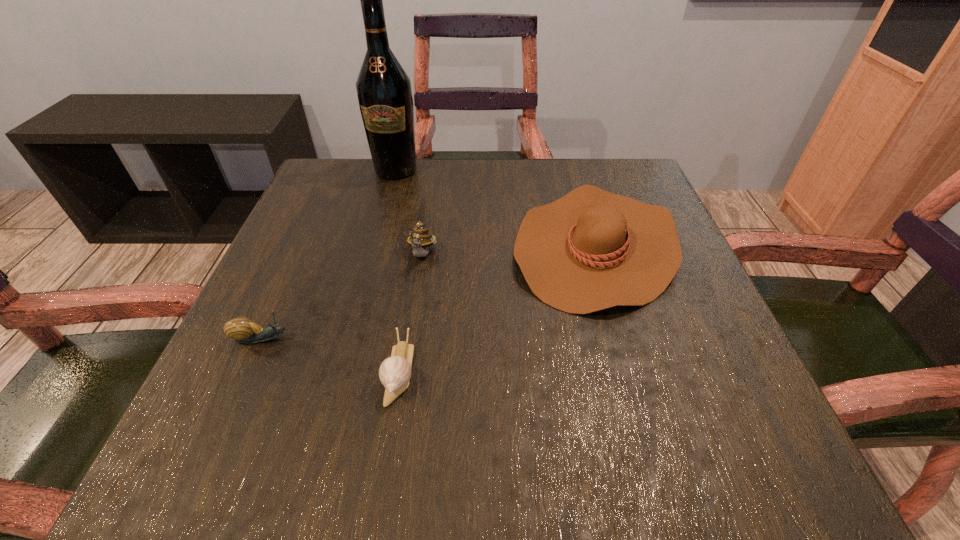
Where is `vacant space that's between the wine bottle and the leftmost object`? The height and width of the screenshot is (540, 960). vacant space that's between the wine bottle and the leftmost object is located at coordinates (329, 254).

Locate an element on the screen. The width and height of the screenshot is (960, 540). vacant region between the leftmost escargot and the tallest escargot is located at coordinates (343, 297).

Where is `vacant area that lies between the tallest escargot and the fourth object from right to left`? vacant area that lies between the tallest escargot and the fourth object from right to left is located at coordinates (409, 213).

Identify which object is located as the third nearest to the leftmost object. Please provide its 2D coordinates. Your answer should be formatted as a tuple, i.e. [(x, y)], where the tuple contains the x and y coordinates of a point satisfying the conditions above.

[(590, 250)]

Image resolution: width=960 pixels, height=540 pixels. Find the location of `object identified as the third closest to the fourth object from right to left`. object identified as the third closest to the fourth object from right to left is located at coordinates (243, 330).

Identify the location of escargot that can be found as the third closest to the third shortest object. (243, 330).

Identify which escargot is the nearest to the leftmost object. Please provide its 2D coordinates. Your answer should be formatted as a tuple, i.e. [(x, y)], where the tuple contains the x and y coordinates of a point satisfying the conditions above.

[(395, 372)]

The image size is (960, 540). I want to click on vacant region that satisfies the following two spatial constraints: 1. on the face of the second tallest object; 2. on the front-facing side of the leftmost object, so click(x=410, y=339).

Locate an element on the screen. free location that satisfies the following two spatial constraints: 1. on the label of the cowboy hat; 2. on the right side of the farthest object is located at coordinates pos(375,246).